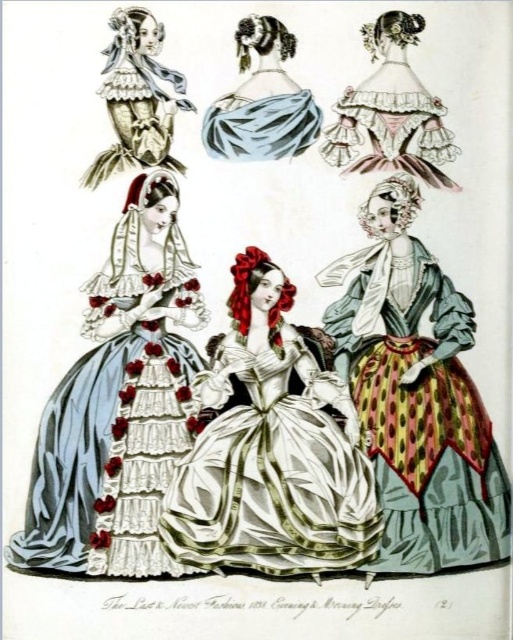
Consider the image. Looking at the top section of the fashion illustration, you notice the matte blue fabric at upper center and the matte white lace dress at upper left. Which one is closer to you?

The matte blue fabric at upper center is closer to you because it is in front of the matte white lace dress at upper left.

Looking at the top section of the fashion illustration, you notice the silk satin dress at center and the light blue satin scarf at upper center. Which object is wider?

The silk satin dress at center is wider than the light blue satin scarf at upper center.